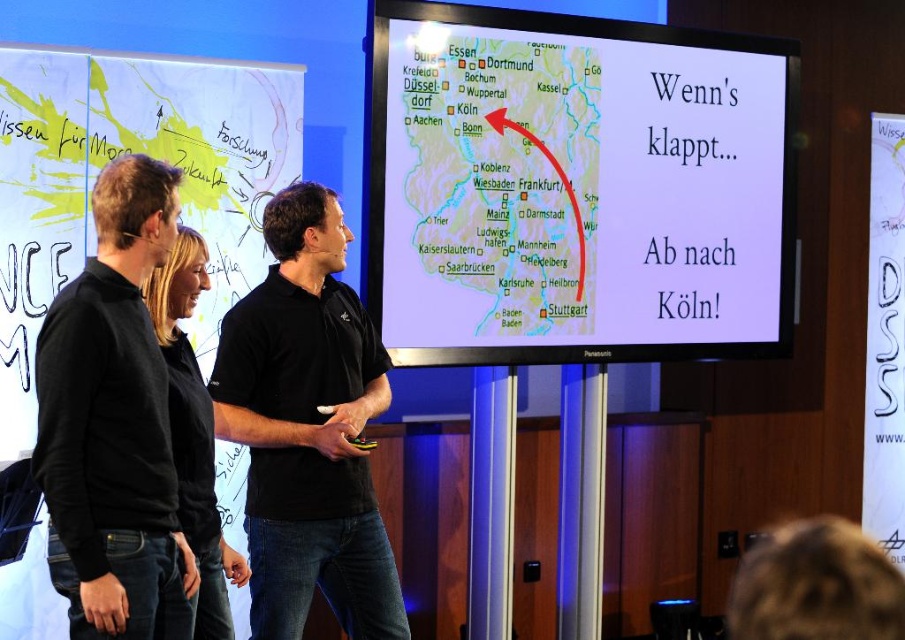
Does point (681, 289) come closer to viewer compared to point (351, 417)?

That is False.

Which is above, matte map at center or black cotton shirt at center?

matte map at center

Which is behind, point (440, 93) or point (240, 364)?

The point (440, 93) is behind.

This screenshot has height=640, width=905. I want to click on matte map at center, so click(575, 188).

Between black cotton shirt at center and black matte sweater at left, which one has more height?

Standing taller between the two is black cotton shirt at center.

Who is lower down, black cotton shirt at center or black matte sweater at left?

black cotton shirt at center is lower down.

What do you see at coordinates (307, 428) in the screenshot? I see `black cotton shirt at center` at bounding box center [307, 428].

Locate an element on the screen. black cotton shirt at center is located at coordinates (307, 428).

Can you confirm if matte map at center is positioned to the left of black matte sweater at left?

Incorrect, matte map at center is not on the left side of black matte sweater at left.

Is matte map at center to the right of black matte sweater at left from the viewer's perspective?

Yes, matte map at center is to the right of black matte sweater at left.

Does point (500, 116) come closer to viewer compared to point (50, 321)?

No, it is behind (50, 321).

Locate an element on the screen. matte map at center is located at coordinates (575, 188).